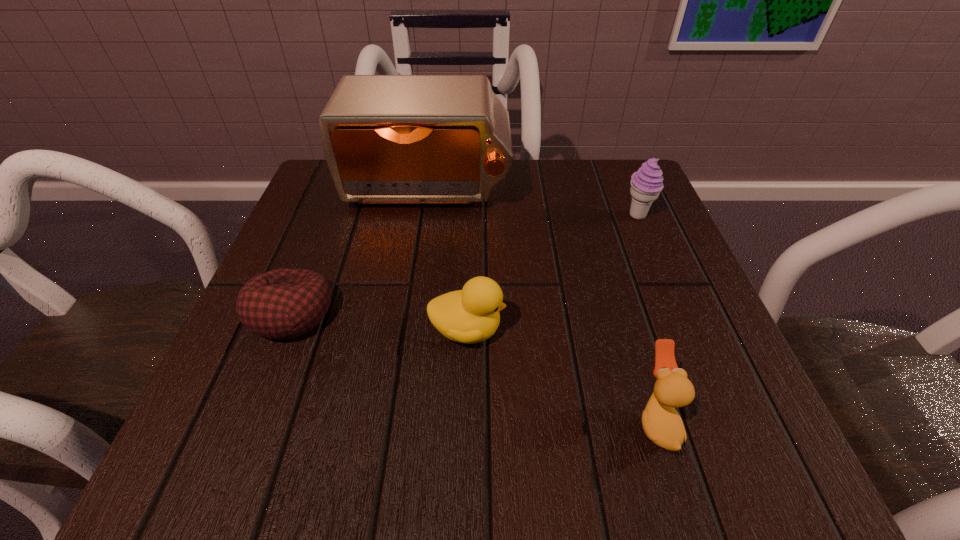
Image resolution: width=960 pixels, height=540 pixels. I want to click on duck that is positioned at the right edge, so [x=662, y=424].

Image resolution: width=960 pixels, height=540 pixels. What are the coordinates of `object that is at the far left corner` in the screenshot? It's located at (387, 139).

Locate an element on the screen. The width and height of the screenshot is (960, 540). object that is at the far right corner is located at coordinates (646, 184).

The width and height of the screenshot is (960, 540). Find the location of `object present at the near right corner`. object present at the near right corner is located at coordinates (662, 424).

In the image, there is a desktop. At what (x,y) coordinates should I click in order to perform the action: click on vacant space at the far edge. Please return your answer as a coordinate pair (x, y). The height and width of the screenshot is (540, 960). Looking at the image, I should click on (532, 198).

The width and height of the screenshot is (960, 540). Find the location of `vacant space at the near edge`. vacant space at the near edge is located at coordinates (425, 443).

This screenshot has width=960, height=540. In the image, there is a desktop. What are the coordinates of `vacant space at the left edge` in the screenshot? It's located at (275, 346).

Identify the location of vacant region at the right edge of the desktop. This screenshot has height=540, width=960. (634, 318).

In the image, there is a desktop. Where is `vacant space at the far left corner`? Image resolution: width=960 pixels, height=540 pixels. vacant space at the far left corner is located at coordinates (309, 208).

In the image, there is a desktop. In order to click on vacant region at the far right corner in this screenshot , I will do `click(592, 202)`.